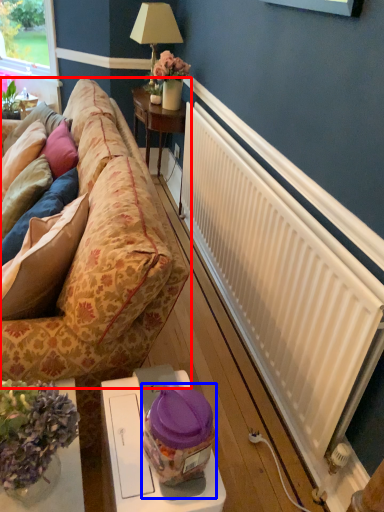
Question: Among these objects, which one is nearest to the camera, studio couch (highlighted by a red box) or food (highlighted by a blue box)?

Choices:
 (A) studio couch
 (B) food

Answer: (B)